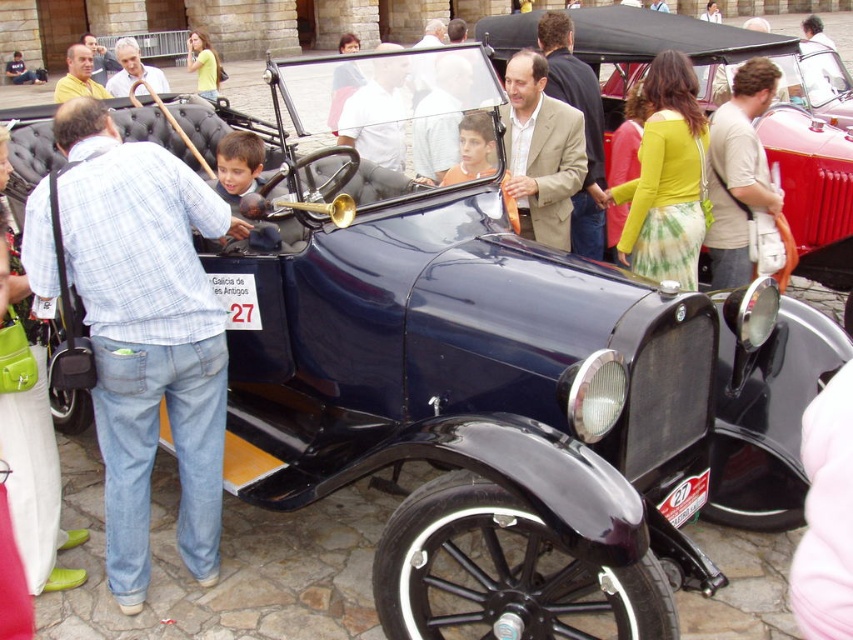
Question: Which object is the closest to the light blue plaid shirt at center?

Choices:
 (A) yellow cotton shirt at upper center
 (B) green tie-dye skirt at center

Answer: (B)

Question: Is green tie-dye skirt at center below matte gray suit at upper left?

Choices:
 (A) yes
 (B) no

Answer: (A)

Question: Can you confirm if matte gray suit at upper left is positioned to the left of matte yellow shirt at upper left?

Choices:
 (A) yes
 (B) no

Answer: (B)

Question: Which of the following is the closest to the observer?

Choices:
 (A) (535, 209)
 (B) (358, 148)
 (C) (660, 113)
 (D) (120, 67)

Answer: (C)

Question: Which point is farther to the camera?

Choices:
 (A) (573, 140)
 (B) (693, 234)

Answer: (A)

Question: Considering the relative positions of light brown leather bag at center and matte gray suit at upper left in the image provided, where is light brown leather bag at center located with respect to matte gray suit at upper left?

Choices:
 (A) below
 (B) above

Answer: (A)